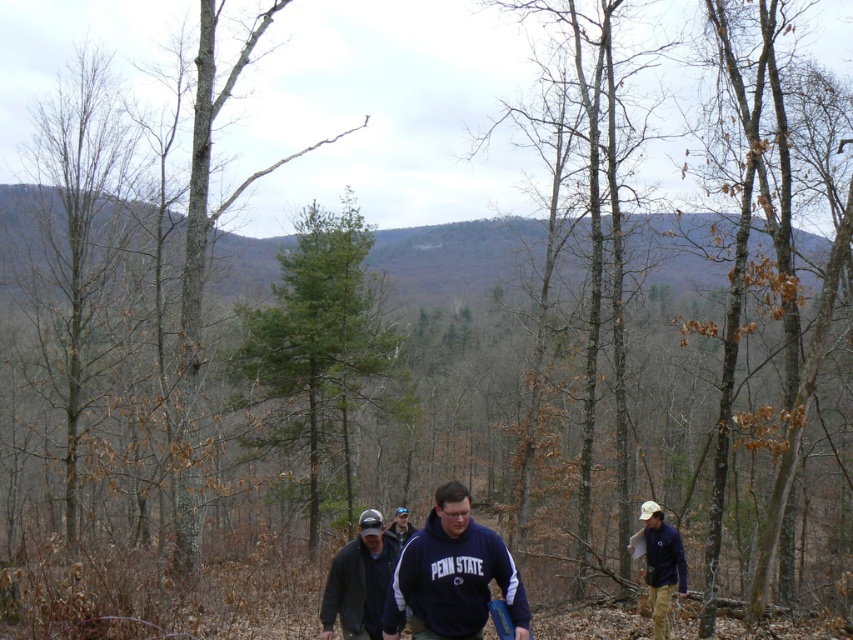
Question: Which point appears closest to the camera in this image?

Choices:
 (A) (662, 595)
 (B) (354, 604)

Answer: (B)

Question: Is dark gray jacket at center thinner than blue fabric jacket at lower right?

Choices:
 (A) yes
 (B) no

Answer: (B)

Question: Does blue fabric jacket at lower right appear under dark blue cotton shirt at center?

Choices:
 (A) no
 (B) yes

Answer: (A)

Question: Can you confirm if navy blue sweatshirt at center is positioned to the right of blue fabric jacket at lower right?

Choices:
 (A) no
 (B) yes

Answer: (A)

Question: Considering the real-world distances, which object is closest to the dark blue cotton shirt at center?

Choices:
 (A) navy blue sweatshirt at center
 (B) blue fabric jacket at lower right

Answer: (B)

Question: Based on their relative distances, which object is nearer to the dark blue cotton shirt at center?

Choices:
 (A) navy blue sweatshirt at center
 (B) dark gray jacket at center

Answer: (B)